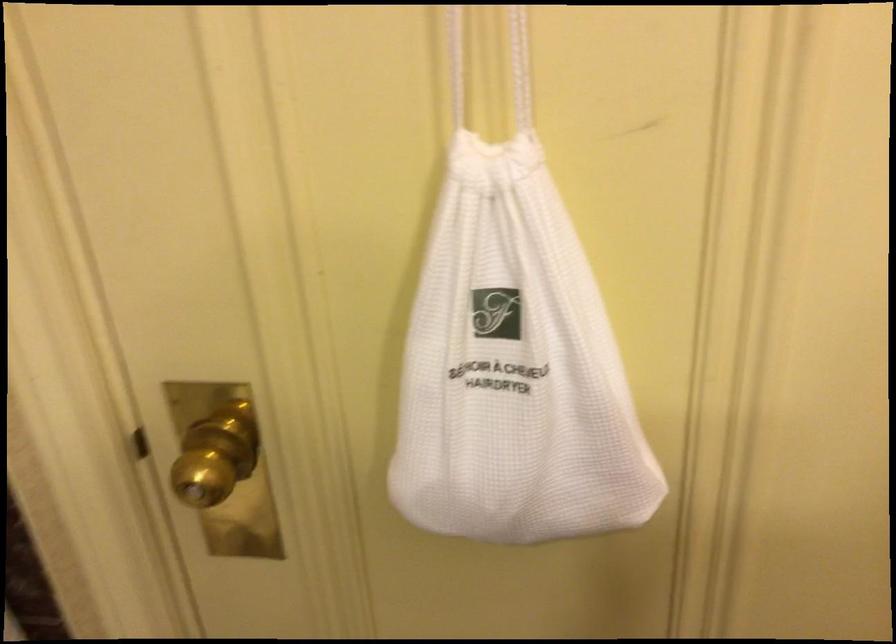
In order to click on white drawstring bag in this screenshot , I will do `click(513, 368)`.